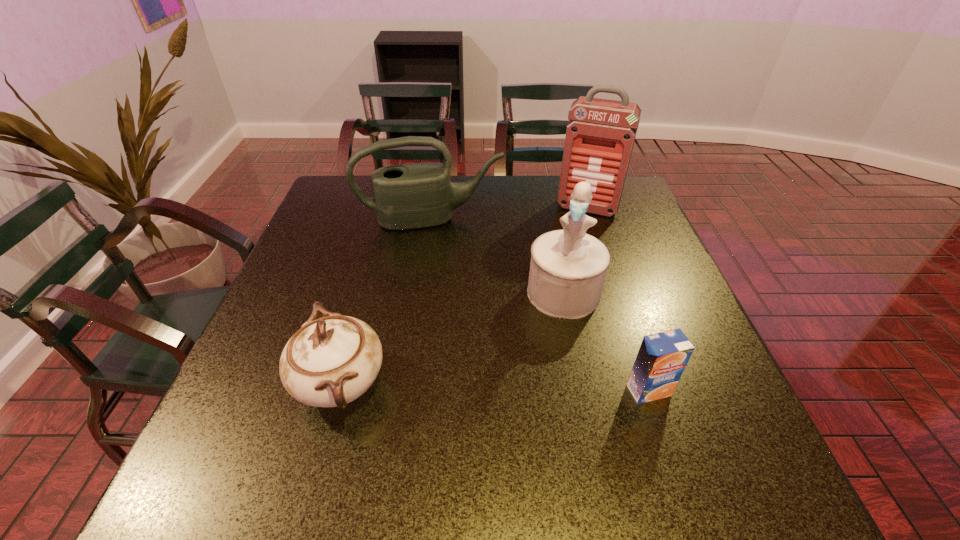
Identify the location of vacant area at the near edge of the desktop. (625, 402).

At what (x,y) coordinates should I click in order to perform the action: click on vacant space at the left edge of the desktop. Please return your answer as a coordinate pair (x, y). Looking at the image, I should click on (336, 276).

You are a GUI agent. You are given a task and a screenshot of the screen. Output one action in this format:
    pyautogui.click(x=<x>, y=<y>)
    Task: Click on the vacant point at the right edge
    This screenshot has width=960, height=540.
    Given the screenshot: What is the action you would take?
    pyautogui.click(x=672, y=276)

In the image, there is a desktop. Where is `vacant space at the far left corner`? This screenshot has height=540, width=960. vacant space at the far left corner is located at coordinates (366, 178).

Where is `vacant space at the near left corner of the desktop`? The height and width of the screenshot is (540, 960). vacant space at the near left corner of the desktop is located at coordinates (246, 429).

Where is `blank space at the far right corner of the desktop`? blank space at the far right corner of the desktop is located at coordinates (626, 181).

Locate an element on the screen. The height and width of the screenshot is (540, 960). unoccupied area between the orange_juice and the chinaware is located at coordinates (494, 387).

In order to click on unoccupied position between the first-aid kit and the shortest object in this screenshot , I will do `click(618, 299)`.

You are a GUI agent. You are given a task and a screenshot of the screen. Output one action in this format:
    pyautogui.click(x=<x>, y=<y>)
    Task: Click on the free space that is in between the chinaware and the orange_juice
    
    Given the screenshot: What is the action you would take?
    pyautogui.click(x=494, y=387)

Where is `free point between the chinaware and the orange_juice`? The height and width of the screenshot is (540, 960). free point between the chinaware and the orange_juice is located at coordinates (494, 387).